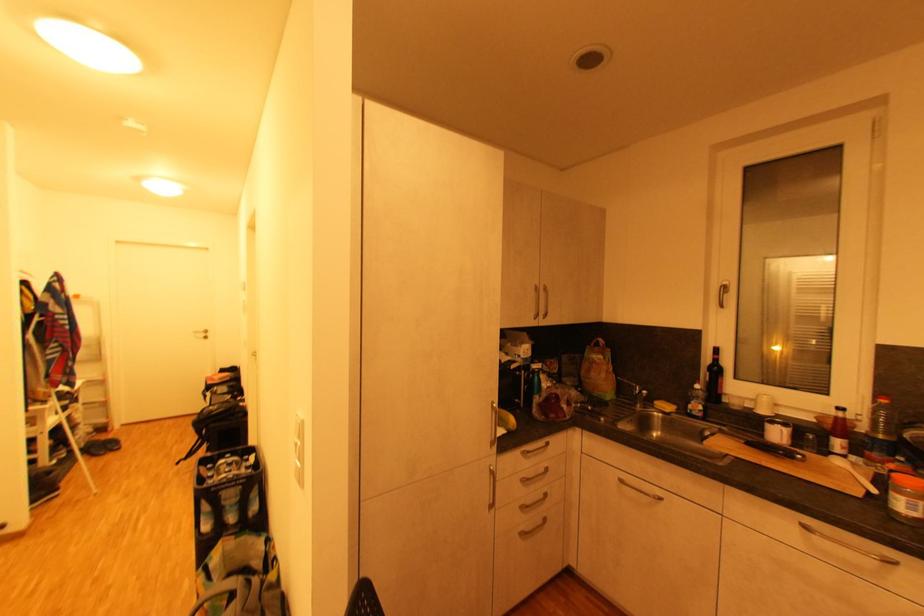
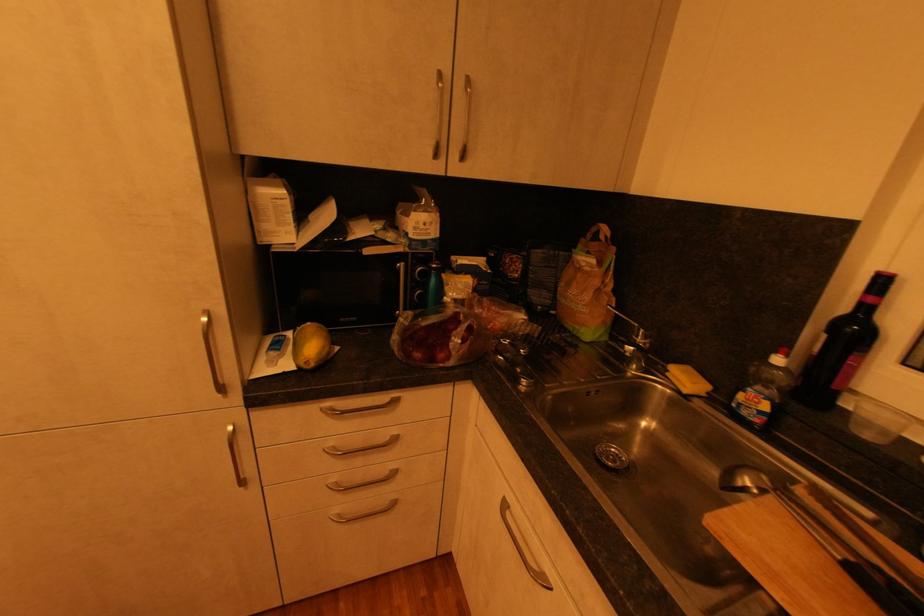
Where in the second image is the point corresponding to pixel 541 318 from the first image?

(441, 156)